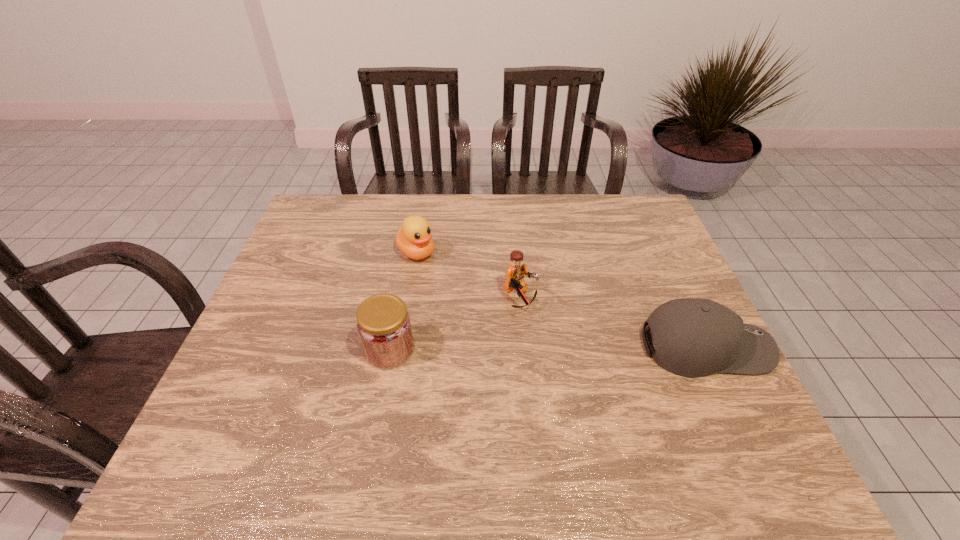
At what (x,y) coordinates should I click in order to perform the action: click on vacant point located between the farthest object and the baseball cap. Please return your answer as a coordinate pair (x, y). Image resolution: width=960 pixels, height=540 pixels. Looking at the image, I should click on (561, 300).

Identify the location of free space between the Lego and the duckling. The width and height of the screenshot is (960, 540). (468, 275).

Where is `vacant space that's between the rightmost object and the jam`? The width and height of the screenshot is (960, 540). vacant space that's between the rightmost object and the jam is located at coordinates (547, 348).

I want to click on free space between the farthest object and the second farthest object, so click(468, 275).

The width and height of the screenshot is (960, 540). Find the location of `vacant area that lies between the duckling and the rightmost object`. vacant area that lies between the duckling and the rightmost object is located at coordinates (561, 300).

Locate an element on the screen. The height and width of the screenshot is (540, 960). free space between the rightmost object and the duckling is located at coordinates (561, 300).

Find the location of a particular element. The width and height of the screenshot is (960, 540). vacant area that lies between the farthest object and the rightmost object is located at coordinates (561, 300).

Identify which object is located as the nearest to the duckling. Please provide its 2D coordinates. Your answer should be formatted as a tuple, i.e. [(x, y)], where the tuple contains the x and y coordinates of a point satisfying the conditions above.

[(516, 271)]

Image resolution: width=960 pixels, height=540 pixels. What are the coordinates of `the third closest object relative to the jam` in the screenshot? It's located at (693, 337).

You are a GUI agent. You are given a task and a screenshot of the screen. Output one action in this format:
    pyautogui.click(x=<x>, y=<y>)
    Task: Click on the vacant point that satisfies the following two spatial constraints: 1. on the back side of the jam; 2. on the front brim of the rightmost object
    The image size is (960, 540).
    Given the screenshot: What is the action you would take?
    [390, 347]